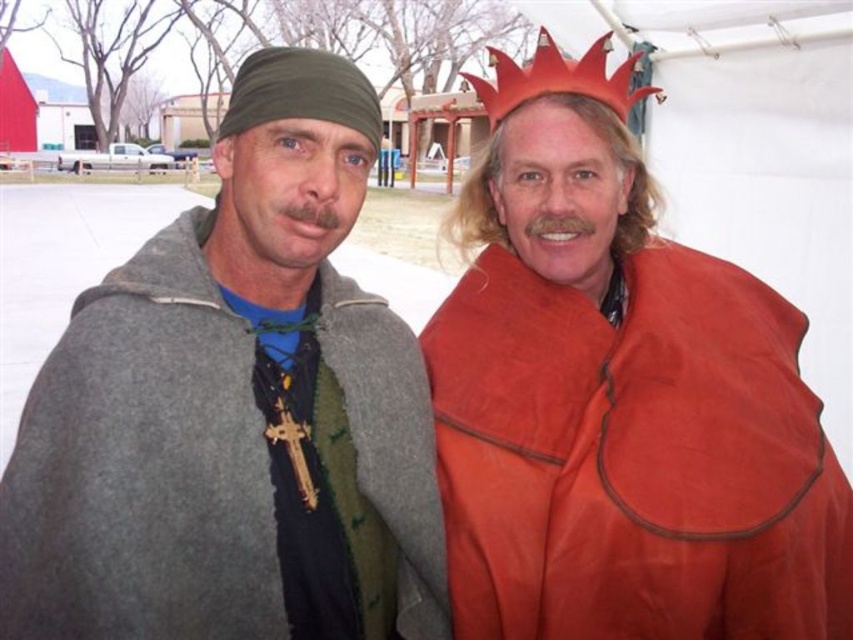
Question: Which object is closer to the camera taking this photo?

Choices:
 (A) red felt crown at upper center
 (B) matte orange cape at right

Answer: (B)

Question: Which object is positioned farthest from the matte orange cape at right?

Choices:
 (A) red felt crown at upper center
 (B) gray woolen cape at left

Answer: (A)

Question: Based on their relative distances, which object is farther from the gray woolen cape at left?

Choices:
 (A) red felt crown at upper center
 (B) matte orange cape at right

Answer: (A)

Question: Is gray woolen cape at left bigger than red felt crown at upper center?

Choices:
 (A) no
 (B) yes

Answer: (A)

Question: Does gray woolen cape at left lie in front of matte orange cape at right?

Choices:
 (A) no
 (B) yes

Answer: (B)

Question: Where is gray woolen cape at left located in relation to matte orange cape at right in the image?

Choices:
 (A) left
 (B) right

Answer: (A)